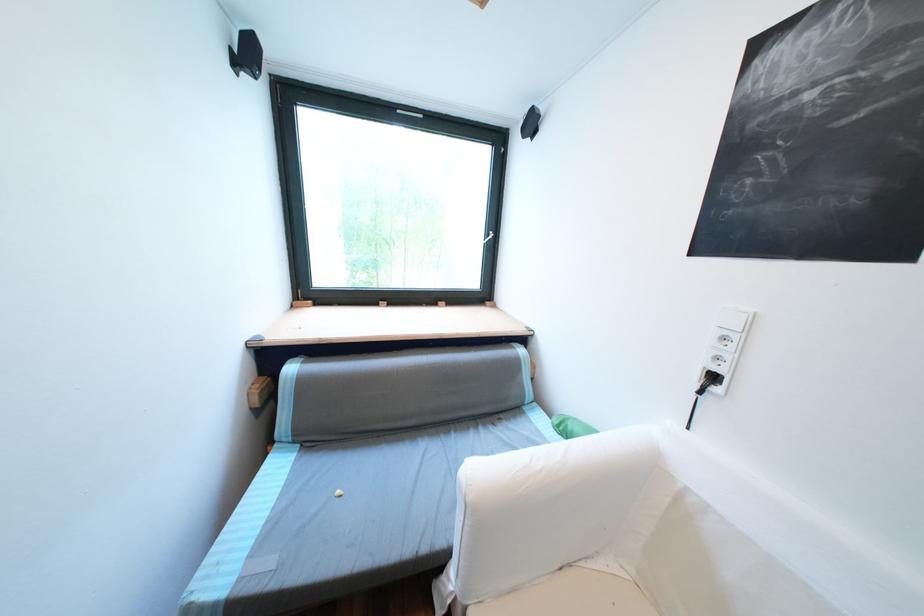
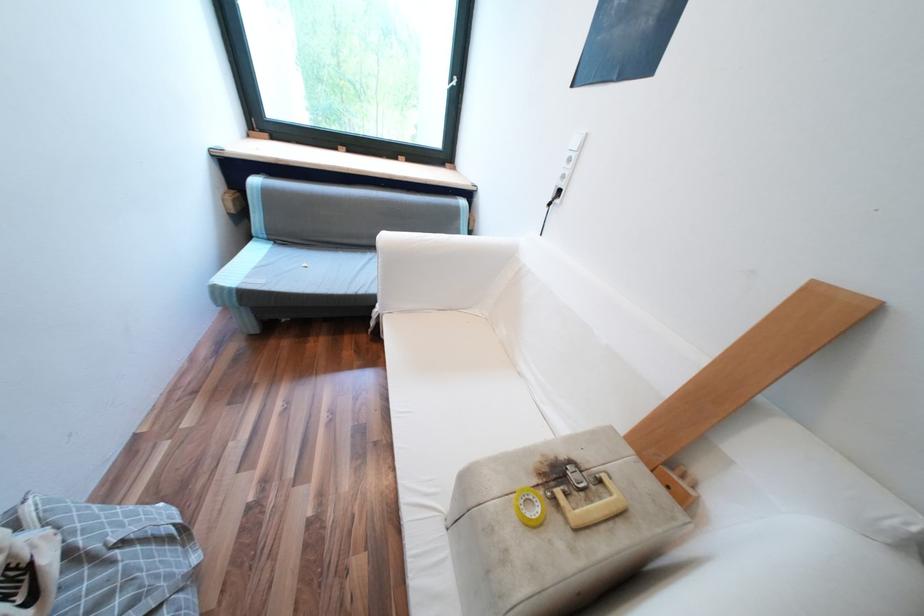
The images are taken continuously from a first-person perspective. In which direction are you moving?

The cameraman walked toward right, backward.